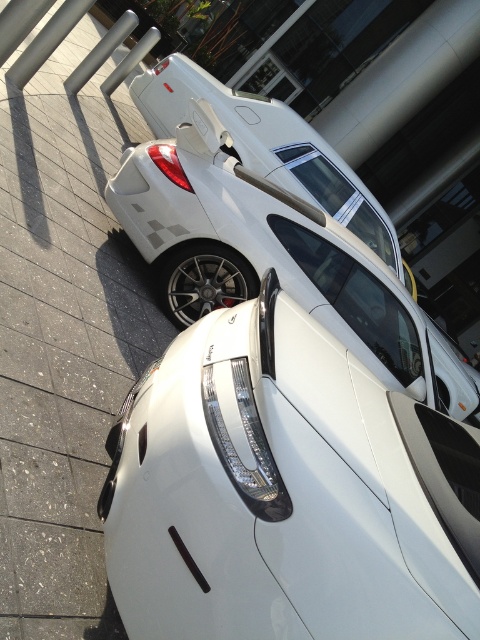
You are standing in front of two white sports cars parked side by side. You notice two points marked on the pavement. The first point is at coordinates point (223, 378) and the second is at point (414, 282). Which point is closer to you?

Point (223, 378) is closer to the viewer than point (414, 282).

You are a parking attendant and need to guide a delivery truck to a spot between the two white glossy cars. Based on the scene, can the truck fit between the white glossy car at center and the white glossy car at upper center?

The white glossy car at center is positioned on the right side of white glossy car at upper center. Since the two cars are parked side by side with the first car on the right of the second, there may not be enough space between them for a delivery truck to fit. The distance between them isn

Based on the photo, you are a parking attendant and need to move the white glossy car at center to make space for a larger vehicle. Can you drive it forward without hitting the white glossy car at upper center?

The white glossy car at center is in front of the white glossy car at upper center, so driving it forward would move it away from the car behind it. Therefore, you can drive the white glossy car at center forward without hitting the white glossy car at upper center.